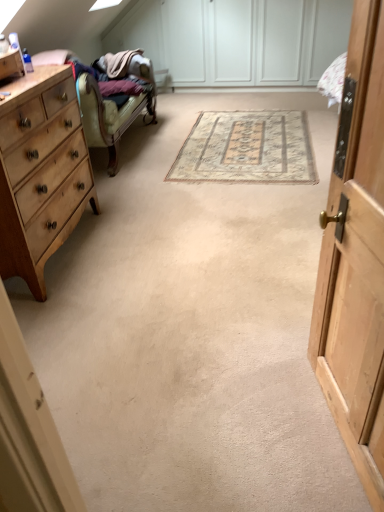
Question: Could you tell me if light wood/finish chest of drawers at left is turned towards wooden cabinet at right?

Choices:
 (A) no
 (B) yes

Answer: (A)

Question: From a real-world perspective, is light wood/finish chest of drawers at left on wooden cabinet at right?

Choices:
 (A) yes
 (B) no

Answer: (B)

Question: Is light wood/finish chest of drawers at left far away from wooden cabinet at right?

Choices:
 (A) yes
 (B) no

Answer: (A)

Question: Is light wood/finish chest of drawers at left located outside wooden cabinet at right?

Choices:
 (A) no
 (B) yes

Answer: (B)

Question: Considering the relative sizes of light wood/finish chest of drawers at left and wooden cabinet at right in the image provided, is light wood/finish chest of drawers at left wider than wooden cabinet at right?

Choices:
 (A) yes
 (B) no

Answer: (A)

Question: Is light wood/finish chest of drawers at left facing away from wooden cabinet at right?

Choices:
 (A) no
 (B) yes

Answer: (A)

Question: Is beige woven rug at center shorter than wooden cabinet at right?

Choices:
 (A) yes
 (B) no

Answer: (A)

Question: Can you confirm if beige woven rug at center is taller than wooden cabinet at right?

Choices:
 (A) yes
 (B) no

Answer: (B)

Question: Is beige woven rug at center thinner than wooden cabinet at right?

Choices:
 (A) no
 (B) yes

Answer: (A)

Question: Can you confirm if beige woven rug at center is positioned to the left of wooden cabinet at right?

Choices:
 (A) yes
 (B) no

Answer: (B)

Question: From the image's perspective, is beige woven rug at center below wooden cabinet at right?

Choices:
 (A) yes
 (B) no

Answer: (B)

Question: From a real-world perspective, is beige woven rug at center below wooden cabinet at right?

Choices:
 (A) no
 (B) yes

Answer: (B)

Question: Can we say wooden cabinet at right lies outside beige woven rug at center?

Choices:
 (A) no
 (B) yes

Answer: (B)